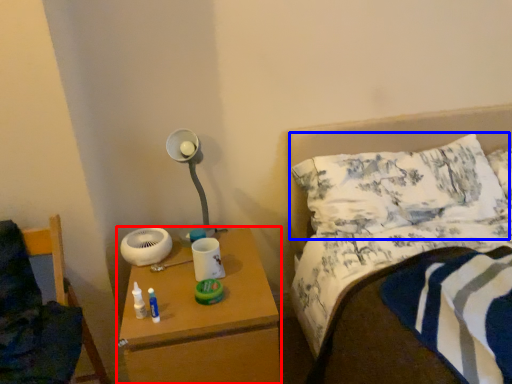
Question: Among these objects, which one is nearest to the camera, nightstand (highlighted by a red box) or pillow (highlighted by a blue box)?

Choices:
 (A) nightstand
 (B) pillow

Answer: (A)